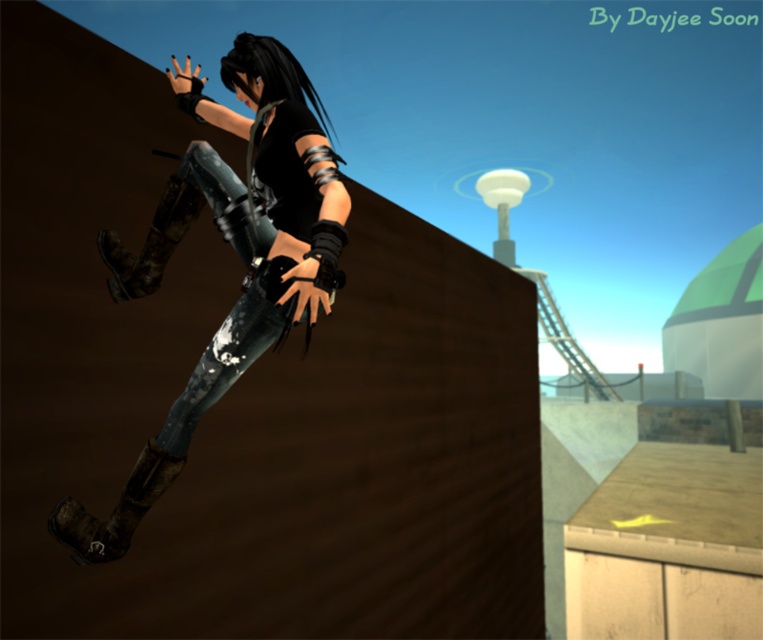
You are a fashion designer analyzing the image. You need to determine if the denim jeans at left can be paired with the camouflage fabric boot at left in a new collection. Based on their spatial relationship in the image, is there any reason the jeans might not fit well with the boot?

The denim jeans at left might be wider than camouflage fabric boot at left, which could cause the jeans to bunch or look ill fitted around the ankle area when paired together.

You are a game character trying to jump over a wall. You notice your denim jeans at left and camouflage fabric boot at left. Which item is higher up in your current position?

The denim jeans at left is taller than the camouflage fabric boot at left, so the denim jeans at left is higher up.

You are a character in the scene and need to choose between the muddy leather boot at lower left and the camouflage fabric boot at left to place a small GPS tracker. Which boot has a wider surface to attach it without slipping?

The muddy leather boot at lower left has a wider surface than the camouflage fabric boot at left, so it is better to place the GPS tracker there to prevent slipping.